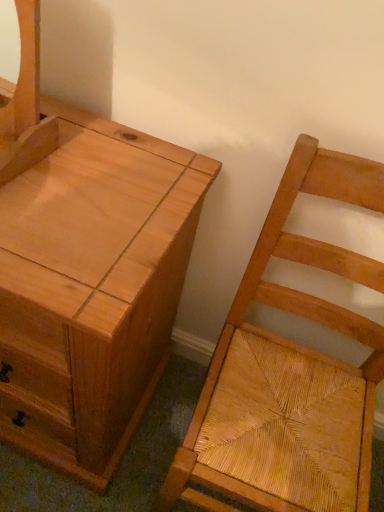
Question: Does natural wood woven seat at right have a smaller size compared to natural wood chest of drawers at left?

Choices:
 (A) yes
 (B) no

Answer: (A)

Question: Is natural wood woven seat at right in contact with natural wood chest of drawers at left?

Choices:
 (A) no
 (B) yes

Answer: (A)

Question: Considering the relative sizes of natural wood woven seat at right and natural wood chest of drawers at left in the image provided, is natural wood woven seat at right taller than natural wood chest of drawers at left?

Choices:
 (A) no
 (B) yes

Answer: (B)

Question: From a real-world perspective, is natural wood woven seat at right beneath natural wood chest of drawers at left?

Choices:
 (A) yes
 (B) no

Answer: (B)

Question: Is natural wood woven seat at right facing away from natural wood chest of drawers at left?

Choices:
 (A) no
 (B) yes

Answer: (A)

Question: Can you confirm if natural wood woven seat at right is shorter than natural wood chest of drawers at left?

Choices:
 (A) no
 (B) yes

Answer: (A)

Question: Considering the relative sizes of natural wood chest of drawers at left and natural wood woven seat at right in the image provided, is natural wood chest of drawers at left wider than natural wood woven seat at right?

Choices:
 (A) no
 (B) yes

Answer: (B)

Question: Is natural wood chest of drawers at left bigger than natural wood woven seat at right?

Choices:
 (A) no
 (B) yes

Answer: (B)

Question: Is natural wood chest of drawers at left not close to natural wood woven seat at right?

Choices:
 (A) no
 (B) yes

Answer: (A)

Question: Could natural wood woven seat at right be considered to be inside natural wood chest of drawers at left?

Choices:
 (A) yes
 (B) no

Answer: (B)

Question: Would you say natural wood chest of drawers at left is outside natural wood woven seat at right?

Choices:
 (A) yes
 (B) no

Answer: (A)

Question: Does natural wood chest of drawers at left have a greater height compared to natural wood woven seat at right?

Choices:
 (A) yes
 (B) no

Answer: (B)

Question: In terms of height, does natural wood chest of drawers at left look taller or shorter compared to natural wood woven seat at right?

Choices:
 (A) short
 (B) tall

Answer: (A)